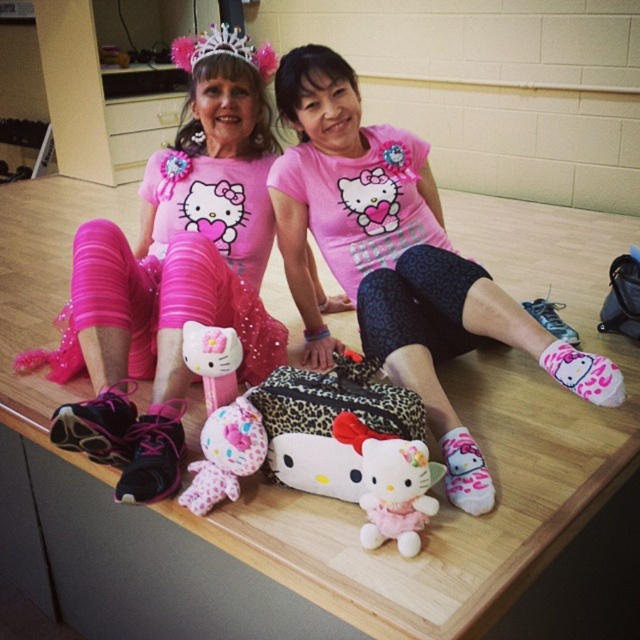
You are organizing a childrens party and need to decide which item to place on a small gift box. The matte plastic hello kitty toy at center and the feathered pink tiara at upper center are options. Which item would you choose and why?

The matte plastic hello kitty toy at center is smaller than the feathered pink tiara at upper center, so it would be more suitable for placing on a small gift box due to its compact size.

From the picture: You are a photographer standing in front of the two individuals. You want to take a closeup photo of the feathered pink tiara at upper center. Is the tiara within the standard camera focus range of 1.5 meters to 2.5 meters?

The distance of the feathered pink tiara at upper center from the camera is 1.81 meters, which falls within the standard camera focus range of 1.5 meters to 2.5 meters. Therefore, the tiara is within the focus range and can be captured clearly.

You are a photographer setting up for a photoshoot. You need to position a light source between the pink matte hello kitty shirt at center and the pink sequined dress at left. Based on their positions, which object should the light be placed closer to in order to illuminate both subjects evenly?

The light should be placed closer to the pink sequined dress at left because the pink matte hello kitty shirt at center is closer to the viewer, so positioning the light nearer to the farther object will help balance the illumination between both subjects.